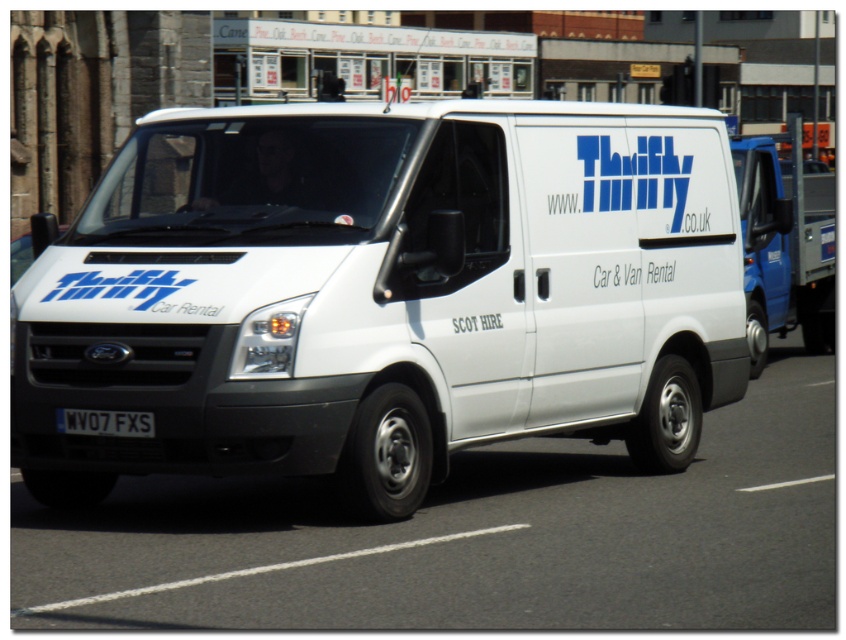
Question: Which object appears farthest from the camera in this image?

Choices:
 (A) black plastic license plate at center
 (B) white matte van at center

Answer: (A)

Question: Which object appears farthest from the camera in this image?

Choices:
 (A) white matte van at center
 (B) black plastic license plate at center

Answer: (B)

Question: Is white matte van at center closer to camera compared to black plastic license plate at center?

Choices:
 (A) no
 (B) yes

Answer: (B)

Question: Does white matte van at center appear over black plastic license plate at center?

Choices:
 (A) yes
 (B) no

Answer: (A)

Question: Observing the image, what is the correct spatial positioning of white matte van at center in reference to black plastic license plate at center?

Choices:
 (A) right
 (B) left

Answer: (A)

Question: Among these points, which one is nearest to the camera?

Choices:
 (A) (504, 397)
 (B) (133, 413)

Answer: (B)